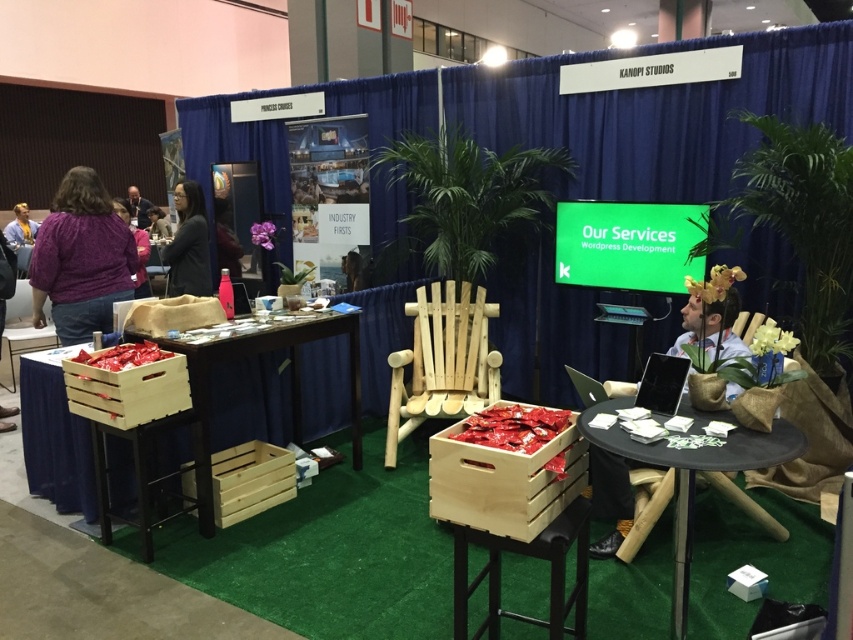
You are attending the trade show and want to sit down. You see the natural wood chair at center. Is the chair positioned in the middle of the booth?

The natural wood chair at center is located at point [442,362], which is close to the center coordinates but slightly offset. Therefore, the chair is positioned near the middle of the booth but not exactly at the center.

You are a trade show attendee who wants to sit down and review the promotional materials. The wooden crate at center and the purple cotton shirt at left are both in your path. Which object should you move to make space, considering their thickness?

The wooden crate at center is thinner than the purple cotton shirt at left, so you should move the wooden crate at center to make space since it is easier to move due to its smaller size.

You are a visitor at the trade show and want to take a seat. The wooden crate at center and the purple cotton shirt at left are in your path. Which object is smaller and would be easier to step over?

The wooden crate at center is smaller compared to the purple cotton shirt at left, so it would be easier to step over.